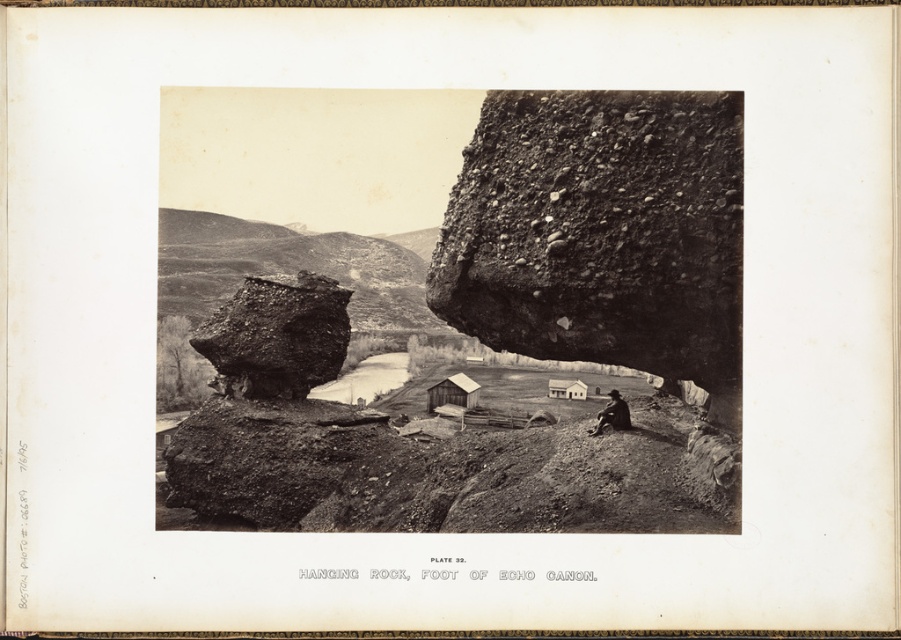
Can you confirm if rustic wood cabin at center is taller than dark brown leather jacket at lower right?

Yes.

Consider the image. Can you confirm if rustic wood cabin at center is positioned below dark brown leather jacket at lower right?

Yes, rustic wood cabin at center is below dark brown leather jacket at lower right.

Between point (466, 380) and point (626, 406), which one is positioned behind?

Point (466, 380)

Where is `rustic wood cabin at center`? The image size is (901, 640). rustic wood cabin at center is located at coordinates (452, 392).

Can you confirm if dark brown leather jacket at lower right is wider than white wooden hut at center?

No.

Who is more forward, (608, 403) or (569, 381)?

Positioned in front is point (608, 403).

The image size is (901, 640). Identify the location of dark brown leather jacket at lower right. (612, 413).

Does rusty stone rock at center-left appear over dark brown leather jacket at lower right?

Yes.

Which of these two, rusty stone rock at center-left or dark brown leather jacket at lower right, stands shorter?

dark brown leather jacket at lower right

Does point (296, 371) come in front of point (628, 420)?

No.

At what (x,y) coordinates should I click in order to perform the action: click on rusty stone rock at center-left. Please return your answer as a coordinate pair (x, y). The height and width of the screenshot is (640, 901). Looking at the image, I should click on (276, 337).